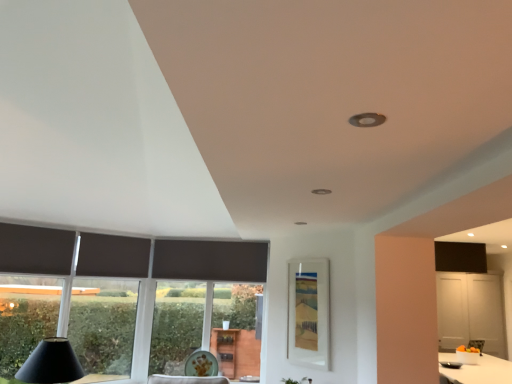
Where is `dark matte curtain at left, which is the first curtain in front-to-back order`? dark matte curtain at left, which is the first curtain in front-to-back order is located at coordinates (35, 250).

Where is `porcelain plate at lower center`? This screenshot has width=512, height=384. porcelain plate at lower center is located at coordinates (201, 364).

Describe the element at coordinates (113, 256) in the screenshot. This screenshot has width=512, height=384. I see `dark matte curtain at left, which appears as the first curtain when viewed from the back` at that location.

Locate an element on the screen. matte black cone at lower left is located at coordinates (51, 363).

This screenshot has width=512, height=384. I want to click on dark matte curtain at left, which is the first curtain in front-to-back order, so click(35, 250).

Considering the sizes of objects transparent glass window at left and porcelain plate at lower center in the image provided, who is smaller, transparent glass window at left or porcelain plate at lower center?

With smaller size is porcelain plate at lower center.

Is porcelain plate at lower center surrounded by transparent glass window at left?

No, porcelain plate at lower center is not a part of transparent glass window at left.

From a real-world perspective, is transparent glass window at left positioned over porcelain plate at lower center based on gravity?

Yes, from a real-world perspective, transparent glass window at left is over porcelain plate at lower center

Between point (84, 310) and point (192, 370), which one is positioned behind?

Positioned behind is point (84, 310).

From a real-world perspective, relative to matte glass window screen at center, is matte black cone at lower left vertically above or below?

matte black cone at lower left is below matte glass window screen at center.

Is matte black cone at lower left oriented towards matte glass window screen at center?

No, matte black cone at lower left is not turned towards matte glass window screen at center.

In terms of size, does matte black cone at lower left appear bigger or smaller than matte glass window screen at center?

Considering their sizes, matte black cone at lower left takes up more space than matte glass window screen at center.

Is matte black cone at lower left further to camera compared to matte glass window screen at center?

No, matte black cone at lower left is in front of matte glass window screen at center.

Is transparent glass window at left taller than matte black cone at lower left?

Yes.

From a real-world perspective, which object rests below the other?

From a 3D spatial view, matte black cone at lower left is below.

Which is closer to the camera, (74, 284) or (80, 371)?

Point (74, 284) is farther from the camera than point (80, 371).

Which of these two, transparent glass window at left or matte black cone at lower left, is bigger?

With larger size is matte black cone at lower left.

Looking at this image, is dark matte curtain at left, which appears as the first curtain when viewed from the back, aimed at transparent glass window at left?

No, dark matte curtain at left, which appears as the first curtain when viewed from the back, is not facing towards transparent glass window at left.

Which is in front, point (118, 273) or point (106, 289)?

The point (118, 273) is closer.

From the image's perspective, is dark matte curtain at left, which appears as the first curtain when viewed from the back, positioned above or below transparent glass window at left?

dark matte curtain at left, which appears as the first curtain when viewed from the back, is above transparent glass window at left.

Is dark matte curtain at left, marked as the 2th curtain in a left-to-right arrangement, spatially inside transparent glass window at left, or outside of it?

dark matte curtain at left, marked as the 2th curtain in a left-to-right arrangement, can be found inside transparent glass window at left.

At what (x,y) coordinates should I click in order to perform the action: click on round table behind the dark matte curtain at left, which is the first curtain in front-to-back order. Please return your answer as a coordinate pair (x, y). The image size is (512, 384). Looking at the image, I should click on (201, 364).

Is dark matte curtain at left, arranged as the second curtain when viewed from the back, at the back of porcelain plate at lower center?

No, porcelain plate at lower center is not facing away from dark matte curtain at left, arranged as the second curtain when viewed from the back.

Is dark matte curtain at left, which is the second curtain in right-to-left order, a part of porcelain plate at lower center?

No, dark matte curtain at left, which is the second curtain in right-to-left order, is not surrounded by porcelain plate at lower center.

How far apart are porcelain plate at lower center and dark matte curtain at left, which is the second curtain in right-to-left order?

They are 1.69 meters apart.

Does transparent glass window at left have a lesser height compared to dark matte curtain at left, which is the second curtain in front-to-back order?

No, transparent glass window at left is not shorter than dark matte curtain at left, which is the second curtain in front-to-back order.

Are transparent glass window at left and dark matte curtain at left, arranged as the first curtain when viewed from the right, located far from each other?

Yes, transparent glass window at left and dark matte curtain at left, arranged as the first curtain when viewed from the right, are quite far apart.

In the image, is transparent glass window at left positioned in front of or behind dark matte curtain at left, marked as the 2th curtain in a left-to-right arrangement?

In the image, transparent glass window at left appears in front of dark matte curtain at left, marked as the 2th curtain in a left-to-right arrangement.

How different are the orientations of transparent glass window at left and dark matte curtain at left, marked as the 2th curtain in a left-to-right arrangement, in degrees?

The angular difference between transparent glass window at left and dark matte curtain at left, marked as the 2th curtain in a left-to-right arrangement, is 0.00601 degrees.

From the image's perspective, between matte black cone at lower left and transparent glass window at left, which one is located above?

transparent glass window at left.

Is matte black cone at lower left taller than transparent glass window at left?

Incorrect, the height of matte black cone at lower left is not larger of that of transparent glass window at left.

Is matte black cone at lower left bigger or smaller than transparent glass window at left?

Clearly, matte black cone at lower left is larger in size than transparent glass window at left.

Considering the relative positions of matte black cone at lower left and transparent glass window at left in the image provided, is matte black cone at lower left to the left of transparent glass window at left from the viewer's perspective?

Yes.

Locate an element on the screen. window located on the left of porcelain plate at lower center is located at coordinates (103, 325).

You are a GUI agent. You are given a task and a screenshot of the screen. Output one action in this format:
    pyautogui.click(x=<x>, y=<y>)
    Task: Click on the window screen that appears above the matte black cone at lower left (from the image's perspective)
    The image size is (512, 384).
    Given the screenshot: What is the action you would take?
    pyautogui.click(x=308, y=312)

Looking at the image, which one is located closer to dark matte curtain at left, which appears as the first curtain when viewed from the back, matte black cone at lower left or matte glass window screen at center?

matte black cone at lower left is closer to dark matte curtain at left, which appears as the first curtain when viewed from the back.

When comparing their distances from dark matte curtain at left, which appears as the first curtain when viewed from the back, does matte glass window screen at center or matte black cone at lower left seem further?

matte glass window screen at center is positioned further to the anchor dark matte curtain at left, which appears as the first curtain when viewed from the back.

Considering their positions, is matte glass window screen at center positioned further to matte black cone at lower left than dark matte curtain at left, which is the first curtain in front-to-back order?

Among the two, matte glass window screen at center is located further to matte black cone at lower left.

Based on their spatial positions, is matte black cone at lower left or matte glass window screen at center further from dark matte curtain at left, which is the first curtain in front-to-back order?

Based on the image, matte glass window screen at center appears to be further to dark matte curtain at left, which is the first curtain in front-to-back order.

Estimate the real-world distances between objects in this image. Which object is further from porcelain plate at lower center, dark matte curtain at left, which is the second curtain in right-to-left order, or matte glass window screen at center?

dark matte curtain at left, which is the second curtain in right-to-left order, lies further to porcelain plate at lower center than the other object.

Estimate the real-world distances between objects in this image. Which object is closer to dark matte curtain at left, arranged as the first curtain when viewed from the right, porcelain plate at lower center or matte black cone at lower left?

matte black cone at lower left is closer to dark matte curtain at left, arranged as the first curtain when viewed from the right.

Estimate the real-world distances between objects in this image. Which object is closer to dark matte curtain at left, which is the first curtain in front-to-back order, porcelain plate at lower center or transparent glass window at left?

The object closer to dark matte curtain at left, which is the first curtain in front-to-back order, is porcelain plate at lower center.

Which object lies nearer to the anchor point dark matte curtain at left, which appears as the first curtain when viewed from the back, matte glass window screen at center or transparent glass window at left?

Based on the image, matte glass window screen at center appears to be nearer to dark matte curtain at left, which appears as the first curtain when viewed from the back.

The height and width of the screenshot is (384, 512). What are the coordinates of `window between matte black cone at lower left and porcelain plate at lower center in the front-back direction` in the screenshot? It's located at (103, 325).

Identify the location of curtain situated between transparent glass window at left and matte glass window screen at center from left to right. (113, 256).

Find the location of a particular element. window between matte black cone at lower left and matte glass window screen at center in the horizontal direction is located at coordinates coord(103,325).

Where is `window located between dark matte curtain at left, arranged as the second curtain when viewed from the back, and matte glass window screen at center in the left-right direction`? window located between dark matte curtain at left, arranged as the second curtain when viewed from the back, and matte glass window screen at center in the left-right direction is located at coordinates (103, 325).